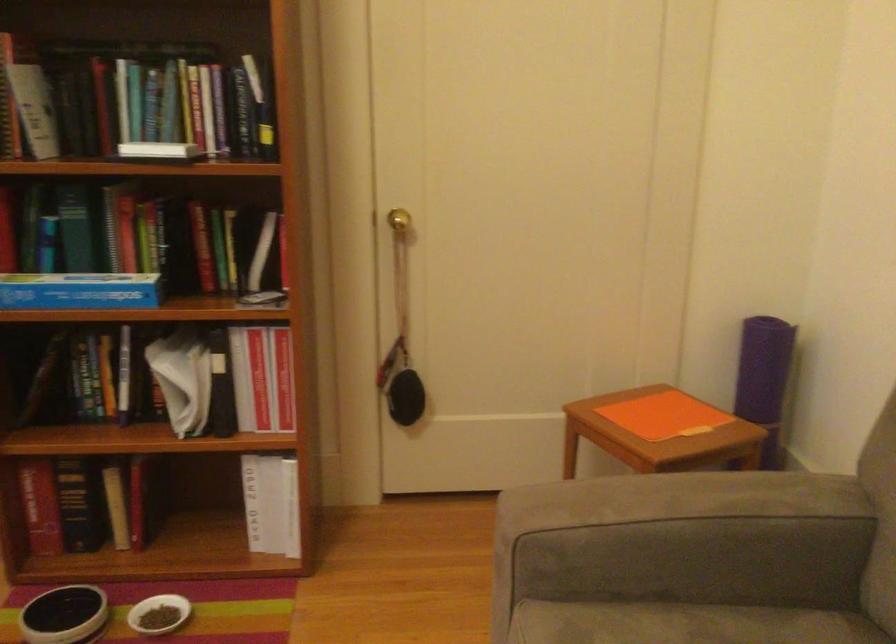
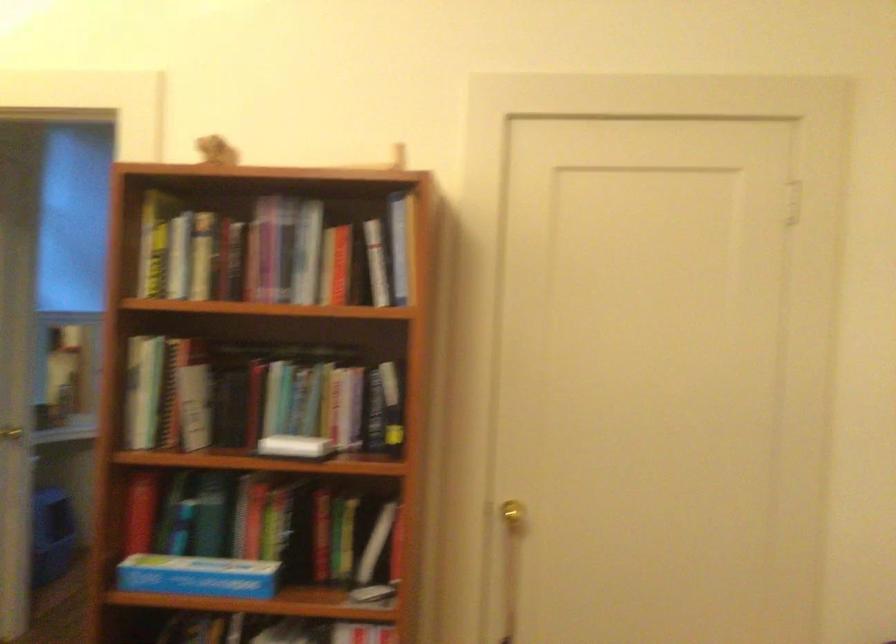
Locate, in the second image, the point that corresponds to point 108,102 in the first image.

(255, 400)